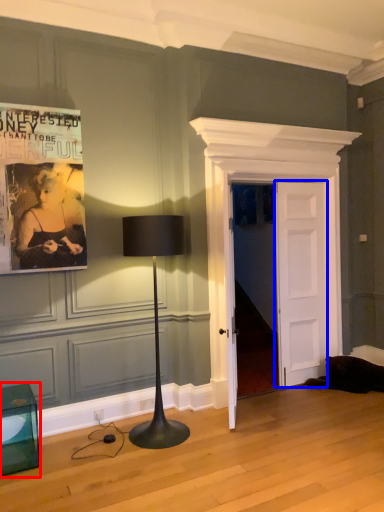
Question: Which of the following is the closest to the observer, furniture (highlighted by a red box) or door (highlighted by a blue box)?

Choices:
 (A) furniture
 (B) door

Answer: (A)